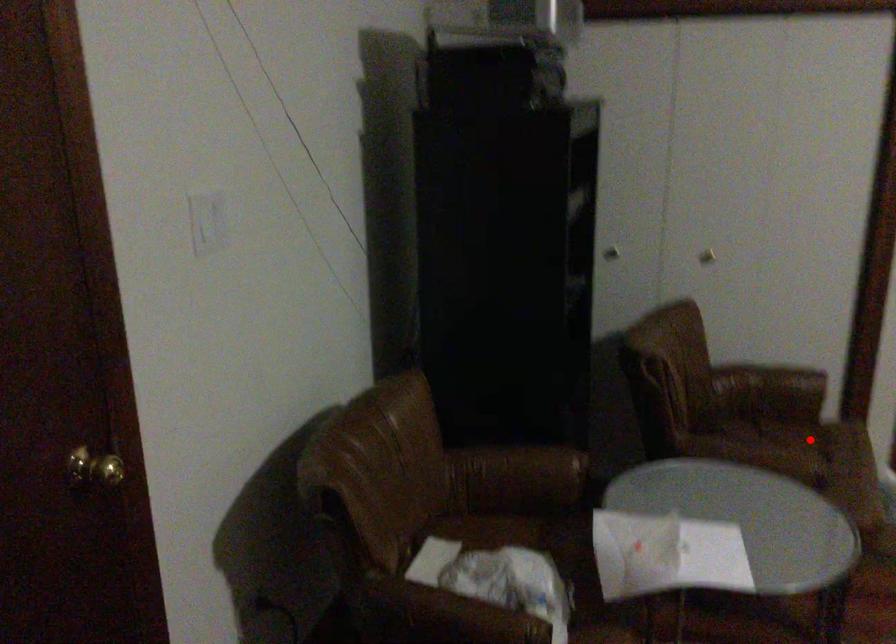
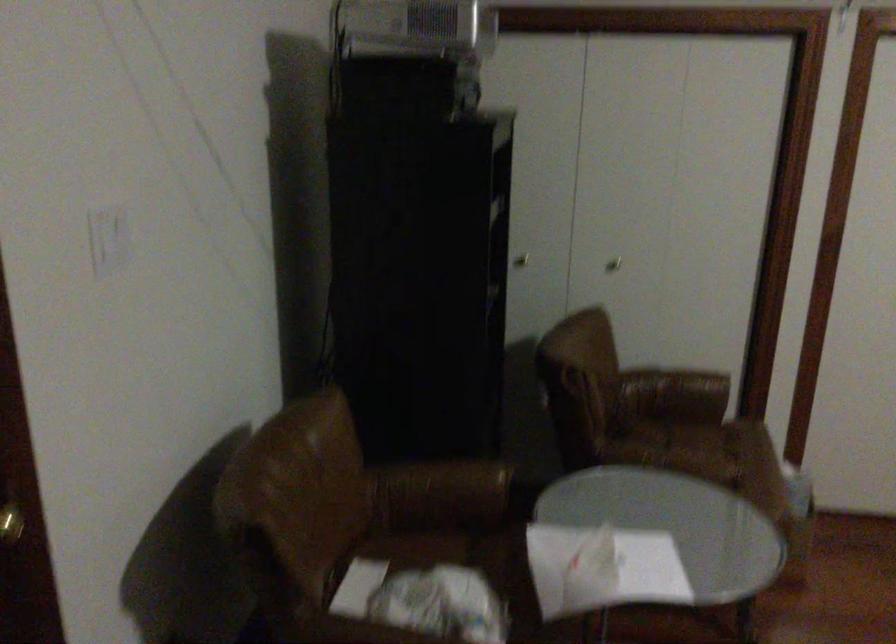
The point at the highlighted location is marked in the first image. Where is the corresponding point in the second image?

(718, 442)